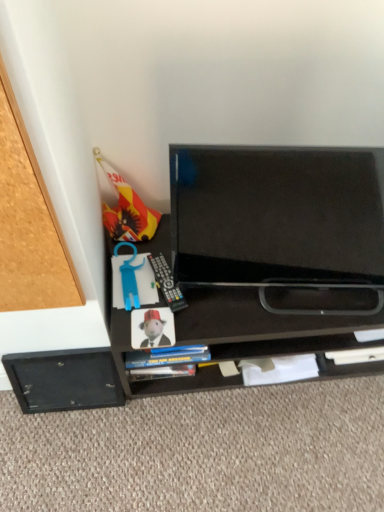
This screenshot has width=384, height=512. In order to click on vacant space in front of black plastic remote at lower center in this screenshot , I will do `click(165, 325)`.